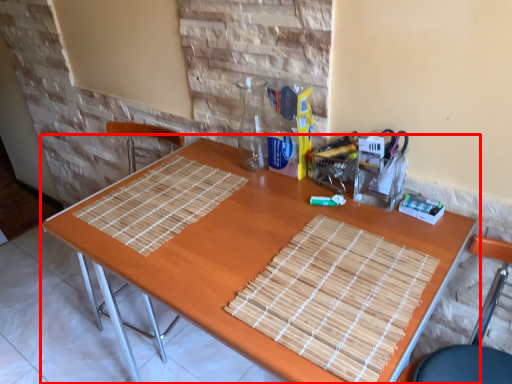
Question: Considering the relative positions of table (annotated by the red box) and chair in the image provided, where is table (annotated by the red box) located with respect to the staircase?

Choices:
 (A) right
 (B) left

Answer: (B)